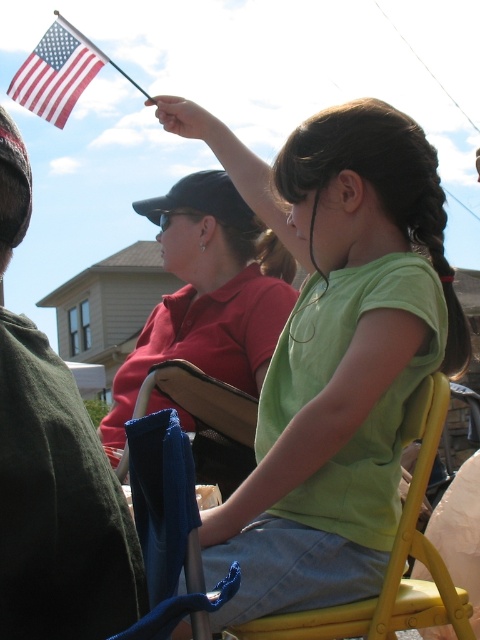
You are a photographer trying to capture a clear shot of the green matte shirt at center and the yellow plastic chair at center. Based on their positions, which object should you focus on first to ensure it appears sharp in the photo?

The green matte shirt at center is closer to the viewer than the yellow plastic chair at center, so you should focus on the green matte shirt at center first to ensure it appears sharp before adjusting focus for the yellow plastic chair at center.